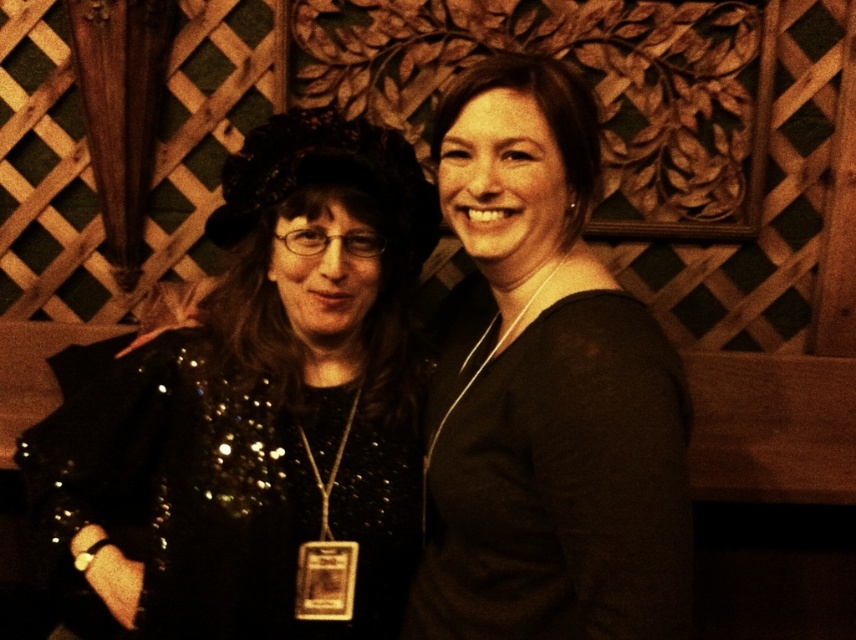
Question: Is black sequined dress at left closer to the viewer compared to black matte dress at center?

Choices:
 (A) no
 (B) yes

Answer: (A)

Question: Can you confirm if black sequined dress at left is positioned to the right of black matte dress at center?

Choices:
 (A) no
 (B) yes

Answer: (A)

Question: From the image, what is the correct spatial relationship of black sequined dress at left in relation to black matte dress at center?

Choices:
 (A) right
 (B) left

Answer: (B)